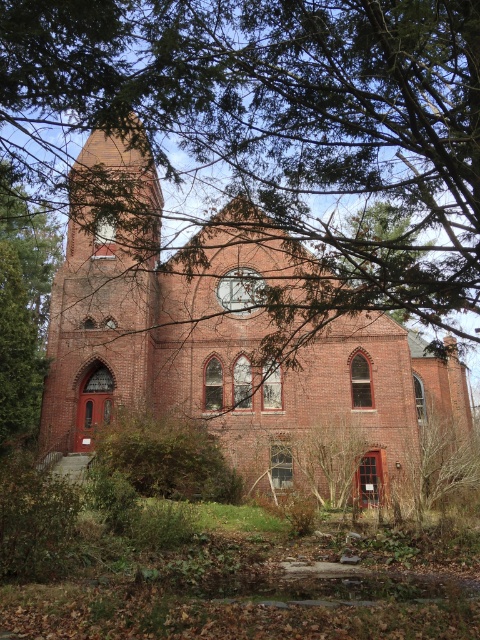
Question: Which of the following is the closest to the observer?

Choices:
 (A) (169, 28)
 (B) (132, 275)

Answer: (A)

Question: Which point is closer to the camera?

Choices:
 (A) (332, 248)
 (B) (144, 298)

Answer: (A)

Question: Which point is closer to the camera taking this photo?

Choices:
 (A) (x=194, y=380)
 (B) (x=148, y=19)

Answer: (B)

Question: Observing the image, what is the correct spatial positioning of green leafy tree at center in reference to brick church at center?

Choices:
 (A) right
 (B) left

Answer: (B)

Question: Can you confirm if green leafy tree at center is thinner than brick church at center?

Choices:
 (A) no
 (B) yes

Answer: (B)

Question: From the image, what is the correct spatial relationship of green leafy tree at center in relation to brick church at center?

Choices:
 (A) right
 (B) left

Answer: (B)